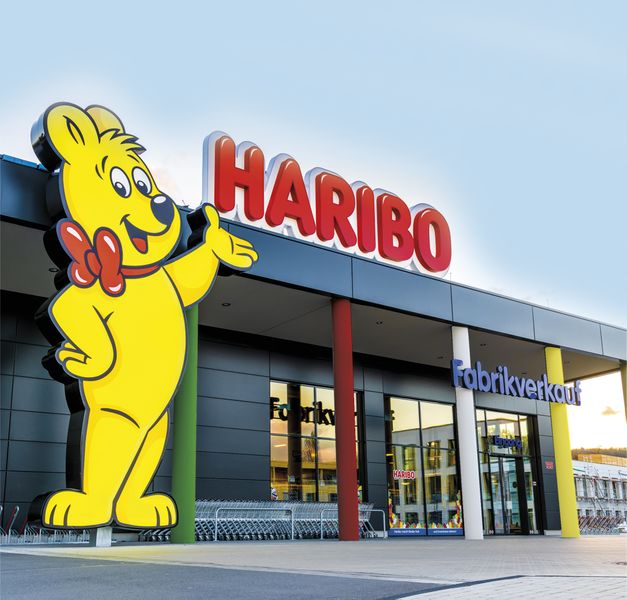
The height and width of the screenshot is (600, 627). Find the location of `yellow pillar`. yellow pillar is located at coordinates (562, 475).